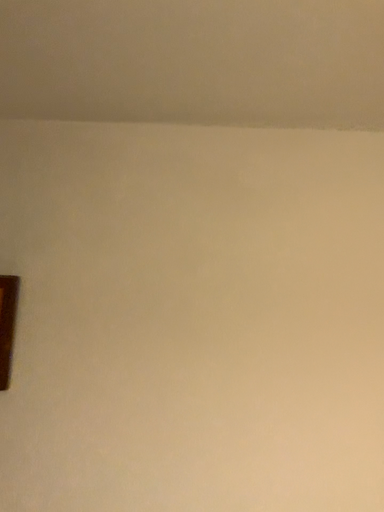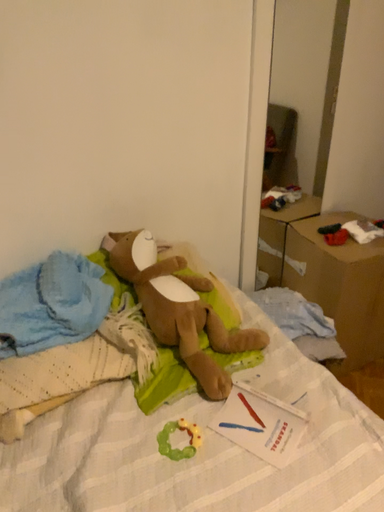
Question: How did the camera likely rotate when shooting the video?

Choices:
 (A) rotated right
 (B) rotated left

Answer: (A)